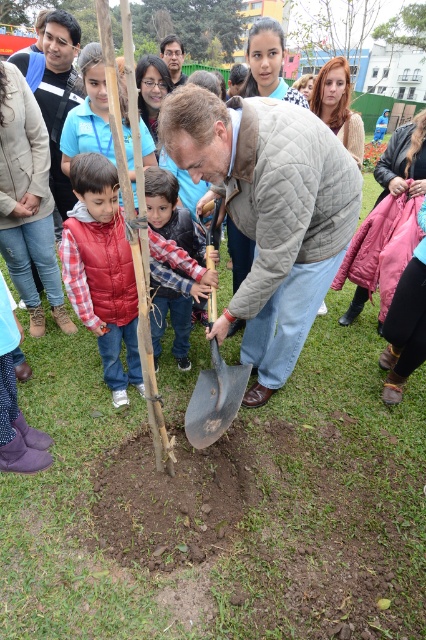
Question: Which point is closer to the camera?

Choices:
 (A) dark gray metal shovel at center
 (B) matte brown jacket at center
 (C) matte blue jacket at upper left

Answer: (A)

Question: Which object is closer to the camera taking this photo?

Choices:
 (A) matte blue jacket at upper left
 (B) matte brown jacket at center
 (C) red plaid shirt at center
 (D) plaid shirt at center

Answer: (C)

Question: Is red plaid shirt at center above dark gray metal shovel at center?

Choices:
 (A) no
 (B) yes

Answer: (B)

Question: Among these objects, which one is nearest to the camera?

Choices:
 (A) plaid shirt at center
 (B) matte blue jacket at upper left

Answer: (A)

Question: Is green wood tree at upper center below plaid shirt at center?

Choices:
 (A) yes
 (B) no

Answer: (B)

Question: Is red plaid shirt at center above matte blue jacket at upper left?

Choices:
 (A) no
 (B) yes

Answer: (A)